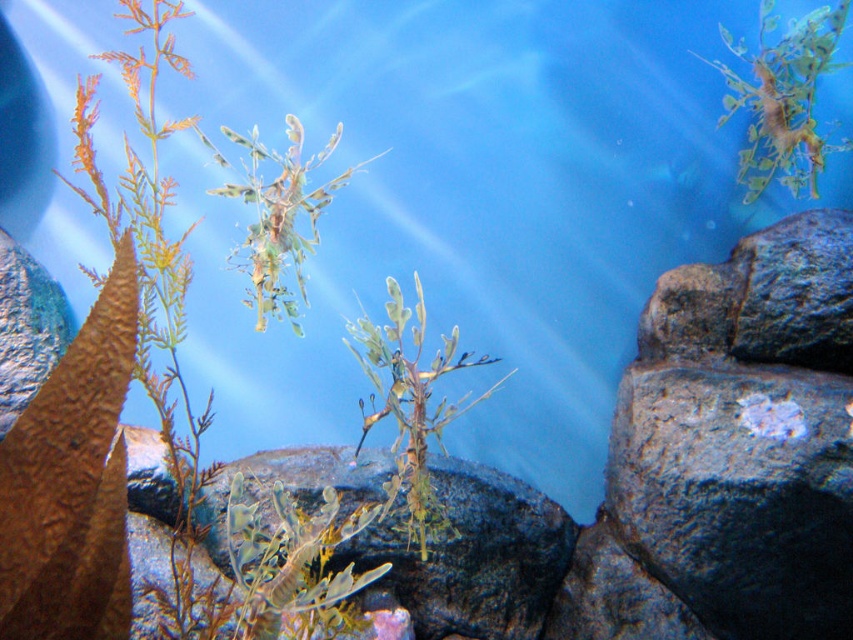
Can you confirm if brown rough rock at center is positioned above green leafy plant at center?

Actually, brown rough rock at center is below green leafy plant at center.

The width and height of the screenshot is (853, 640). In order to click on brown rough rock at center in this screenshot , I will do `click(473, 556)`.

The height and width of the screenshot is (640, 853). In order to click on brown rough rock at center in this screenshot , I will do `click(473, 556)`.

Find the location of a particular element. brown rough rock at center is located at coordinates (473, 556).

Is green translucent plant at center positioned behind green leafy plant at center?

Yes, it is behind green leafy plant at center.

How much distance is there between green translucent plant at center and green leafy plant at center?

green translucent plant at center is 10.17 inches away from green leafy plant at center.

What do you see at coordinates (410, 404) in the screenshot? I see `green translucent plant at center` at bounding box center [410, 404].

The width and height of the screenshot is (853, 640). What are the coordinates of `green translucent plant at center` in the screenshot? It's located at (410, 404).

Can you confirm if green leafy plant at upper right is taller than green leafy plant at center?

In fact, green leafy plant at upper right may be shorter than green leafy plant at center.

From the picture: Which of these two, green leafy plant at upper right or green leafy plant at center, stands shorter?

Standing shorter between the two is green leafy plant at upper right.

This screenshot has height=640, width=853. What do you see at coordinates (782, 99) in the screenshot?
I see `green leafy plant at upper right` at bounding box center [782, 99].

Find the location of `green leafy plant at upper right`. green leafy plant at upper right is located at coordinates (782, 99).